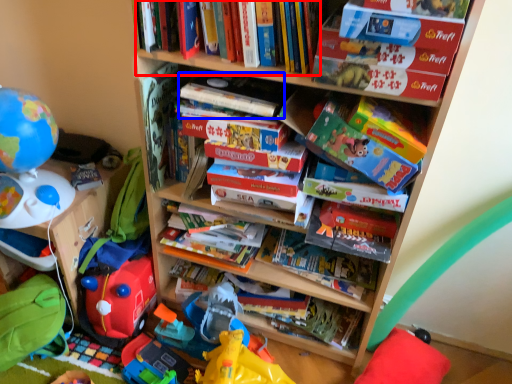
Question: Which object appears closest to the camera in this image, book (highlighted by a red box) or paperback book (highlighted by a blue box)?

Choices:
 (A) book
 (B) paperback book

Answer: (A)